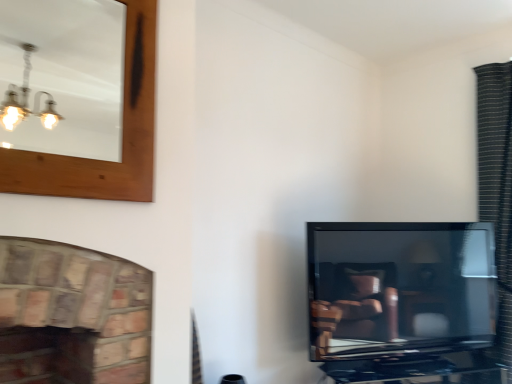
What do you see at coordinates (497, 186) in the screenshot? The width and height of the screenshot is (512, 384). I see `black textured curtain at right` at bounding box center [497, 186].

Find the location of a particular element. This screenshot has width=512, height=384. matte black tv at right is located at coordinates (399, 287).

Are wooden-framed mirror at upper left and matte black tv at right making contact?

No, wooden-framed mirror at upper left is not with matte black tv at right.

Would you say matte black tv at right is part of wooden-framed mirror at upper left's contents?

Definitely not — matte black tv at right is not inside wooden-framed mirror at upper left.

Identify the location of mirror above the matte black tv at right (from the image's perspective). The image size is (512, 384). (62, 76).

How many degrees apart are the facing directions of black textured curtain at right and wooden-framed mirror at upper left?

13.2 degrees separate the facing orientations of black textured curtain at right and wooden-framed mirror at upper left.

Which object is thinner, black textured curtain at right or wooden-framed mirror at upper left?

wooden-framed mirror at upper left is thinner.

Considering the sizes of black textured curtain at right and wooden-framed mirror at upper left in the image, is black textured curtain at right bigger or smaller than wooden-framed mirror at upper left?

Clearly, black textured curtain at right is larger in size than wooden-framed mirror at upper left.

Considering the positions of point (496, 97) and point (97, 106), is point (496, 97) closer or farther from the camera than point (97, 106)?

Point (496, 97) appears to be closer to the viewer than point (97, 106).

From a real-world perspective, who is located higher, matte black tv at right or black textured curtain at right?

In real-world perspective, black textured curtain at right is above.

Is matte black tv at right not near black textured curtain at right?

No, there isn't a large distance between matte black tv at right and black textured curtain at right.

Is matte black tv at right not within black textured curtain at right?

matte black tv at right is positioned outside black textured curtain at right.

Is point (492, 213) farther from camera compared to point (432, 256)?

Yes, it is behind point (432, 256).

From a real-world perspective, is black textured curtain at right positioned over matte black tv at right based on gravity?

Yes, from a real-world perspective, black textured curtain at right is above matte black tv at right.

Would you say black textured curtain at right is outside matte black tv at right?

Indeed, black textured curtain at right is completely outside matte black tv at right.

Considering the positions of objects matte black tv at right and wooden-framed mirror at upper left in the image provided, who is in front, matte black tv at right or wooden-framed mirror at upper left?

wooden-framed mirror at upper left is more forward.

Visually, is matte black tv at right positioned to the left or to the right of wooden-framed mirror at upper left?

Based on their positions, matte black tv at right is located to the right of wooden-framed mirror at upper left.

Would you say matte black tv at right is inside or outside wooden-framed mirror at upper left?

The correct answer is: outside.

From the image's perspective, would you say matte black tv at right is shown under wooden-framed mirror at upper left?

Yes, from the image's perspective, matte black tv at right is below wooden-framed mirror at upper left.

Can you tell me how much wooden-framed mirror at upper left and black textured curtain at right differ in facing direction?

wooden-framed mirror at upper left and black textured curtain at right are facing 13.2 degrees away from each other.

Considering the sizes of objects wooden-framed mirror at upper left and black textured curtain at right in the image provided, who is shorter, wooden-framed mirror at upper left or black textured curtain at right?

wooden-framed mirror at upper left.

Does point (87, 115) lie behind point (504, 63)?

Yes, point (87, 115) is behind point (504, 63).

Identify the location of television located below the wooden-framed mirror at upper left (from the image's perspective). (399, 287).

Image resolution: width=512 pixels, height=384 pixels. In order to click on curtain located on the right of wooden-framed mirror at upper left in this screenshot , I will do `click(497, 186)`.

When comparing their distances from wooden-framed mirror at upper left, does matte black tv at right or black textured curtain at right seem closer?

Among the two, matte black tv at right is located nearer to wooden-framed mirror at upper left.

From the image, which object appears to be nearer to black textured curtain at right, wooden-framed mirror at upper left or matte black tv at right?

matte black tv at right lies closer to black textured curtain at right than the other object.

When comparing their distances from matte black tv at right, does wooden-framed mirror at upper left or black textured curtain at right seem closer?

black textured curtain at right.

From the image, which object appears to be farther from wooden-framed mirror at upper left, black textured curtain at right or matte black tv at right?

black textured curtain at right lies further to wooden-framed mirror at upper left than the other object.

Considering their positions, is black textured curtain at right positioned further to matte black tv at right than wooden-framed mirror at upper left?

wooden-framed mirror at upper left lies further to matte black tv at right than the other object.

Which object lies nearer to the anchor point black textured curtain at right, matte black tv at right or wooden-framed mirror at upper left?

The object closer to black textured curtain at right is matte black tv at right.

Where is `television situated between wooden-framed mirror at upper left and black textured curtain at right from left to right`? This screenshot has height=384, width=512. television situated between wooden-framed mirror at upper left and black textured curtain at right from left to right is located at coordinates (399, 287).